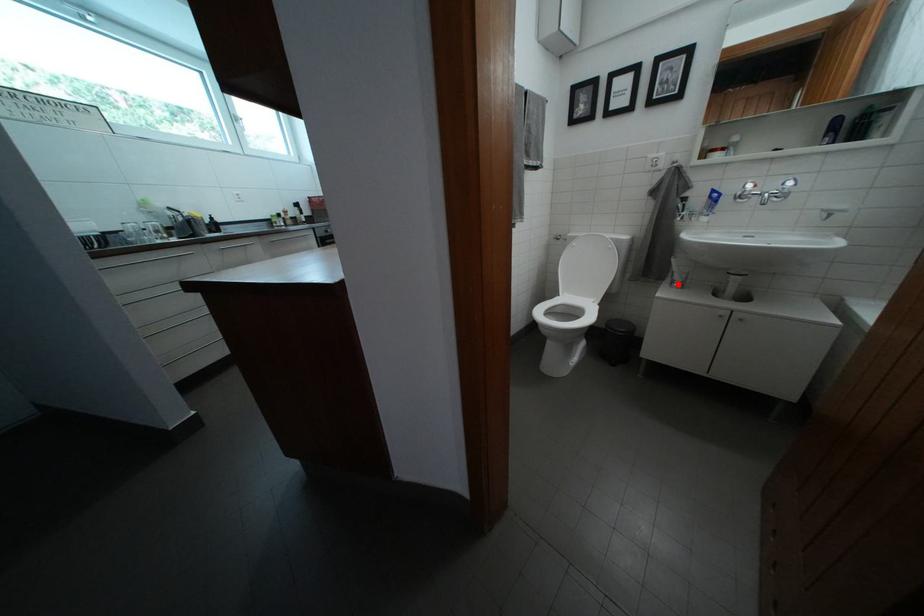
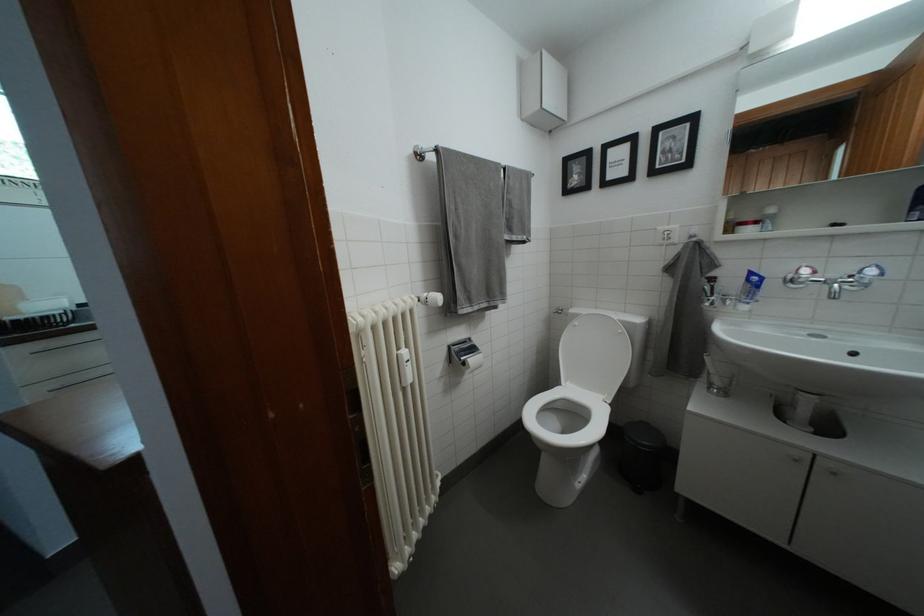
The point at the highlighted location is marked in the first image. Where is the corresponding point in the second image?

(714, 382)